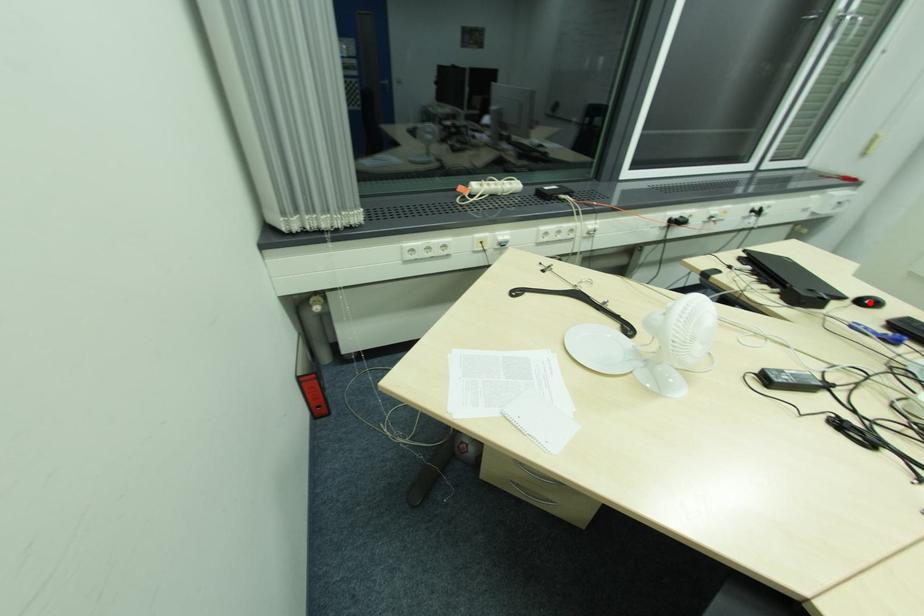
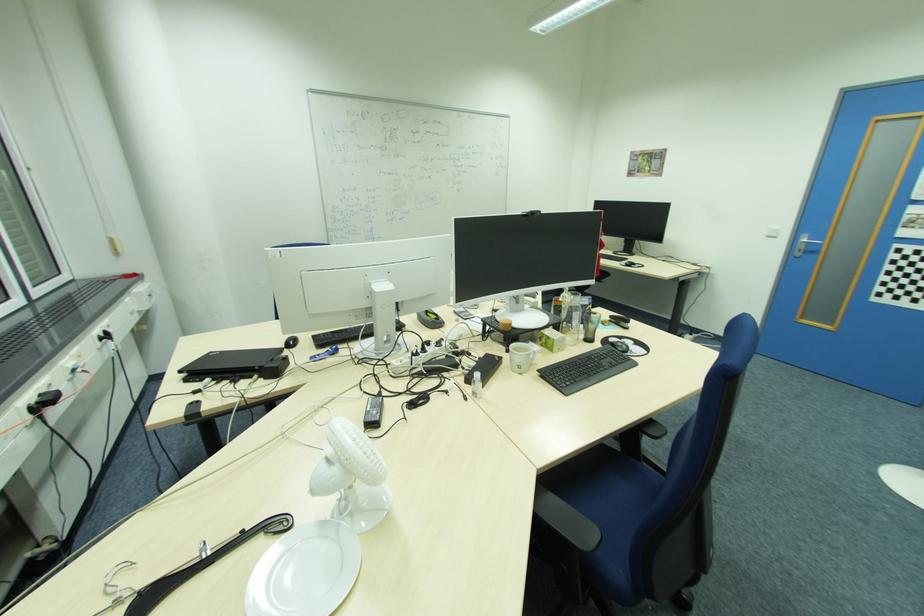
Question: I am providing you with two images of the same scene from different viewpoints. In image1, a red point is highlighted. Considering the same 3D point in image2, which of the following is correct?

Choices:
 (A) It is closer
 (B) It is farther

Answer: (A)